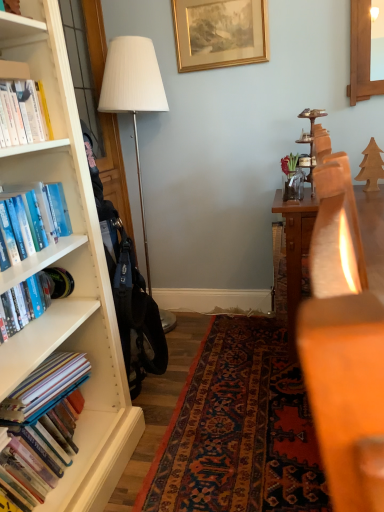
Question: Is white fabric lampshade at left in front of or behind gold metallic picture frame at upper center in the image?

Choices:
 (A) behind
 (B) front

Answer: (B)

Question: Is point (115, 46) positioned closer to the camera than point (253, 30)?

Choices:
 (A) farther
 (B) closer

Answer: (B)

Question: Which is farther from the hardcover books at left, positioned as the first book in bottom-to-top order?

Choices:
 (A) hardcover books at left, arranged as the third book when viewed from the top
 (B) hardcover book at left, which is counted as the third book, starting from the bottom
 (C) gold metallic picture frame at upper center
 (D) white fabric lampshade at left
 (E) blue hardcover book at left, the 4th book in the bottom-to-top sequence

Answer: (C)

Question: Considering the real-world distances, which object is farthest from the blue hardcover book at left, the first book viewed from the top?

Choices:
 (A) hardcover books at left, arranged as the second book when ordered from the bottom
 (B) gold metallic picture frame at upper center
 (C) hardcover book at left, placed as the 2th book when sorted from top to bottom
 (D) hardcover books at left, which appears as the fourth book when viewed from the top
 (E) white fabric lampshade at left

Answer: (B)